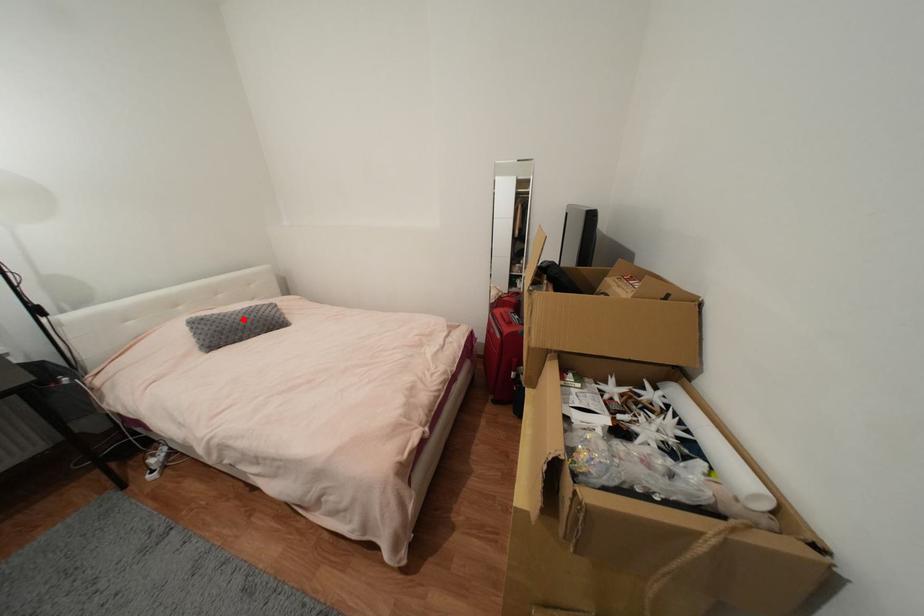
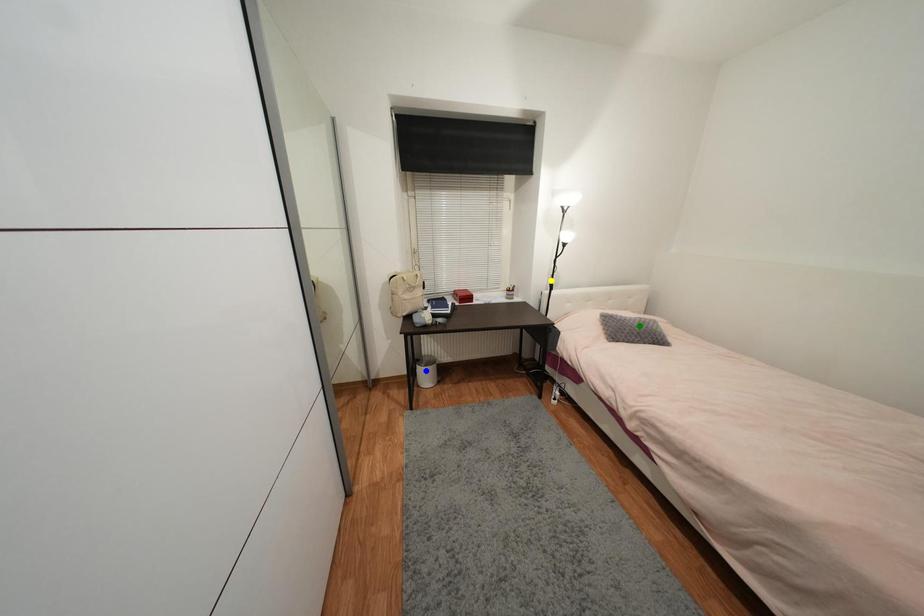
Question: I am providing you with two images of the same scene from different viewpoints. A red point is marked on the first image. You are given multiple points on the second image. Which point in image 2 is actually the same real-world point as the red point in image 1?

Choices:
 (A) blue point
 (B) green point
 (C) yellow point

Answer: (B)